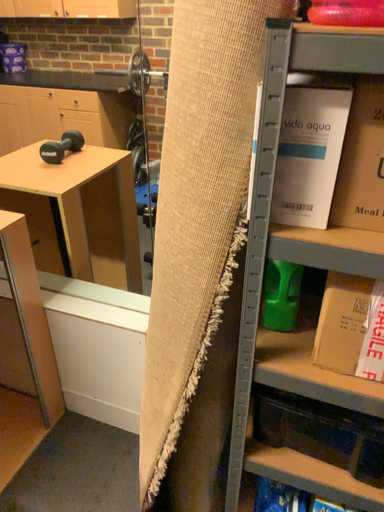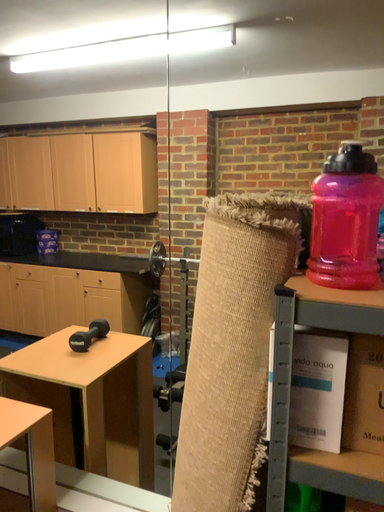
Question: Which way did the camera rotate in the video?

Choices:
 (A) rotated upward
 (B) rotated downward

Answer: (A)